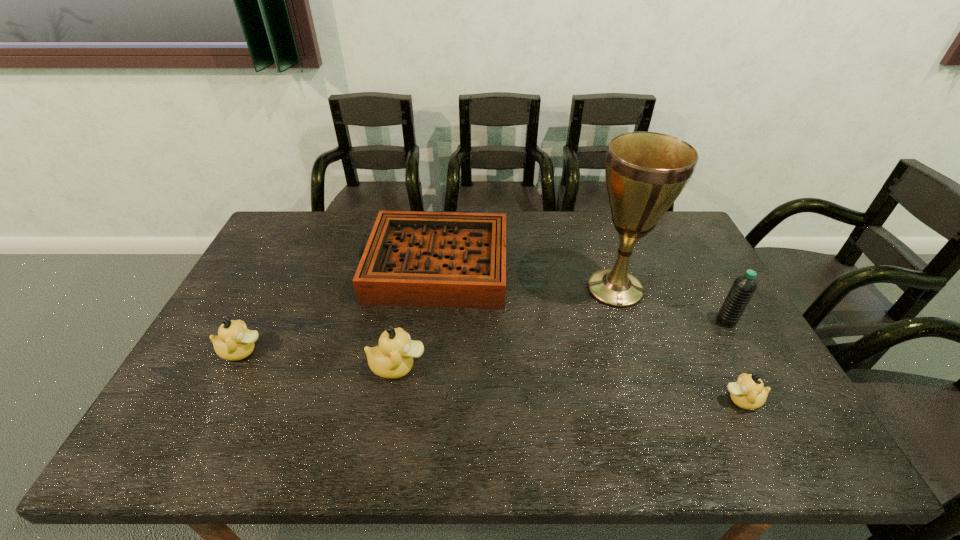
The height and width of the screenshot is (540, 960). I want to click on free spot between the fourth nearest object and the tallest object, so click(670, 305).

The height and width of the screenshot is (540, 960). Find the location of `unoccupied position between the gameboard and the tallest duckling`. unoccupied position between the gameboard and the tallest duckling is located at coordinates (417, 316).

Identify which object is the second nearest to the gameboard. Please provide its 2D coordinates. Your answer should be formatted as a tuple, i.e. [(x, y)], where the tuple contains the x and y coordinates of a point satisfying the conditions above.

[(645, 172)]

Identify which object is located as the nearest to the gameboard. Please provide its 2D coordinates. Your answer should be formatted as a tuple, i.e. [(x, y)], where the tuple contains the x and y coordinates of a point satisfying the conditions above.

[(393, 358)]

Select which duckling appears as the third closest to the tallest object. Please provide its 2D coordinates. Your answer should be formatted as a tuple, i.e. [(x, y)], where the tuple contains the x and y coordinates of a point satisfying the conditions above.

[(234, 342)]

Identify which duckling is the third nearest to the gameboard. Please provide its 2D coordinates. Your answer should be formatted as a tuple, i.e. [(x, y)], where the tuple contains the x and y coordinates of a point satisfying the conditions above.

[(748, 392)]

At what (x,y) coordinates should I click in order to perform the action: click on vacant area in the image that satisfies the following two spatial constraints: 1. on the front side of the trophy cup; 2. on the left side of the fourth nearest object. Please return your answer as a coordinate pair (x, y). The height and width of the screenshot is (540, 960). Looking at the image, I should click on (626, 321).

Where is `vacant area that satisfies the following two spatial constraints: 1. on the front side of the gameboard; 2. on the face of the leftmost duckling`? This screenshot has height=540, width=960. vacant area that satisfies the following two spatial constraints: 1. on the front side of the gameboard; 2. on the face of the leftmost duckling is located at coordinates (425, 352).

This screenshot has width=960, height=540. I want to click on free spot that satisfies the following two spatial constraints: 1. on the front side of the gameboard; 2. on the face of the fourth shortest object, so click(x=423, y=367).